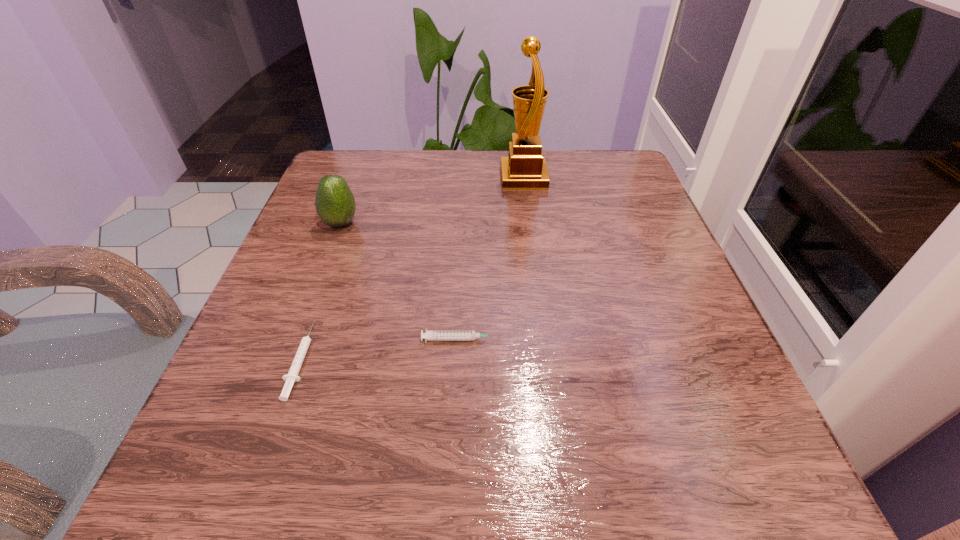
Locate an element on the screen. This screenshot has height=540, width=960. the tallest object is located at coordinates (525, 168).

Find the location of a particular element. Image resolution: width=960 pixels, height=540 pixels. award is located at coordinates (525, 168).

Locate an element on the screen. avocado is located at coordinates (335, 204).

Where is `the second tallest object`? the second tallest object is located at coordinates (335, 204).

Locate an element on the screen. Image resolution: width=960 pixels, height=540 pixels. the second object from right to left is located at coordinates click(x=439, y=335).

Identify the location of the right syringe. (439, 335).

Find the location of a particular element. the shorter syringe is located at coordinates (292, 376).

Find the location of a particular element. The image size is (960, 540). the shortest object is located at coordinates (292, 376).

I want to click on vacant space located on the front-facing side of the award, so click(x=392, y=177).

Find the location of `free location located 0.250m on the front-facing side of the award`. free location located 0.250m on the front-facing side of the award is located at coordinates (396, 177).